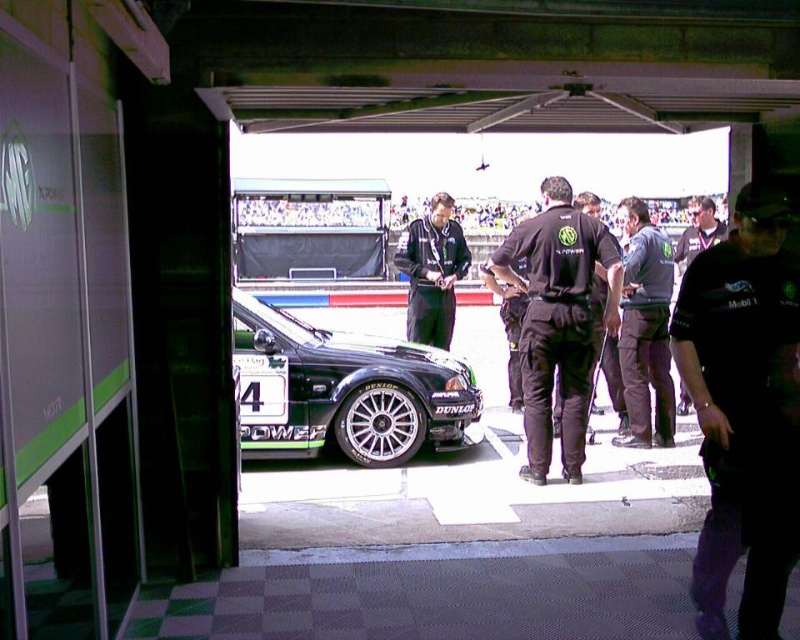
You are a photographer positioned at the pit stop area during a night race. You need to capture a photo of both the shiny black car at center and the black fabric uniform at center in the same frame. Based on their positions, which object should you focus on first to ensure both are in the frame?

The shiny black car at center is located below the black fabric uniform at center. To capture both in the same frame, you should focus on the black fabric uniform at center first, as it is higher up, ensuring the car below remains within the frame.

You are a race team manager observing the pit crew during a night race. You notice two uniforms in the pit area. Which uniform is positioned to the right of the other? The uniforms in question are the black fabric uniform at center and the dark blue uniform at center.

The black fabric uniform at center is positioned to the right of the dark blue uniform at center.

You are a photographer positioned at the pit stop area during a night race. You need to capture a photo of the shiny black car at center and the black fabric uniform at center. According to the scene, which object is positioned to the left of the other?

The shiny black car at center is to the left of the black fabric uniform at center.